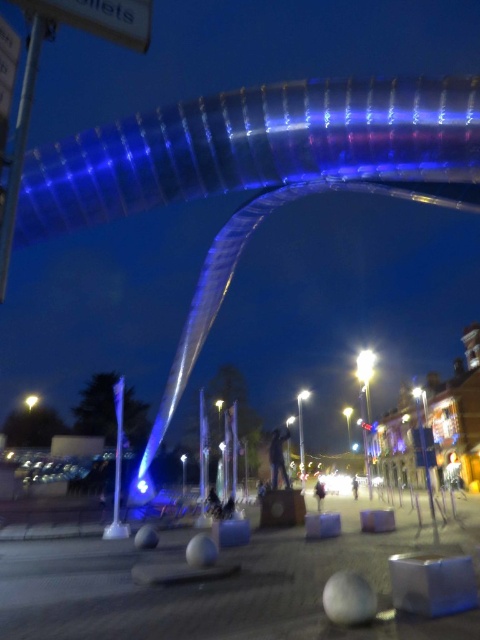
You are a visitor at this night scene and want to take a photo of the white glossy streetlight at center and the yellow glass light at center. Which one should you focus on if you want to capture the larger object in your photo?

The white glossy streetlight at center is larger than the yellow glass light at center, so you should focus on the white glossy streetlight at center to capture the larger object in your photo.

You are standing on the curved bridge and want to install a new light fixture. The white glossy pole at center is currently taller than the yellow glass light at center. If you want the new light to be the tallest object on the bridge, where should you place it?

To ensure the new light becomes the tallest object on the bridge, it should be placed higher than the white glossy pole at center, which is currently the tallest among the listed objects.

You are standing at the entrance of the bridge and want to reach the metallic pole at center. According to the scene description, which direction should you move relative to your current position?

The metallic pole at center is located at point coordinates, so you should move towards the center of the bridge to reach it.